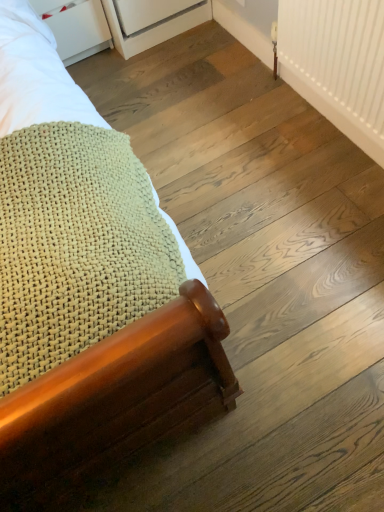
Question: From the image's perspective, is white plastic radiator at upper right above or below white matte drawer at upper left?

Choices:
 (A) below
 (B) above

Answer: (A)

Question: Does point (309, 54) appear closer or farther from the camera than point (89, 14)?

Choices:
 (A) closer
 (B) farther

Answer: (A)

Question: Estimate the real-world distances between objects in this image. Which object is closer to the white matte drawer at upper left?

Choices:
 (A) white plastic radiator at upper right
 (B) wooden bed frame at lower left

Answer: (B)

Question: Which of these objects is positioned farthest from the white matte drawer at upper left?

Choices:
 (A) wooden bed frame at lower left
 (B) white plastic radiator at upper right

Answer: (B)